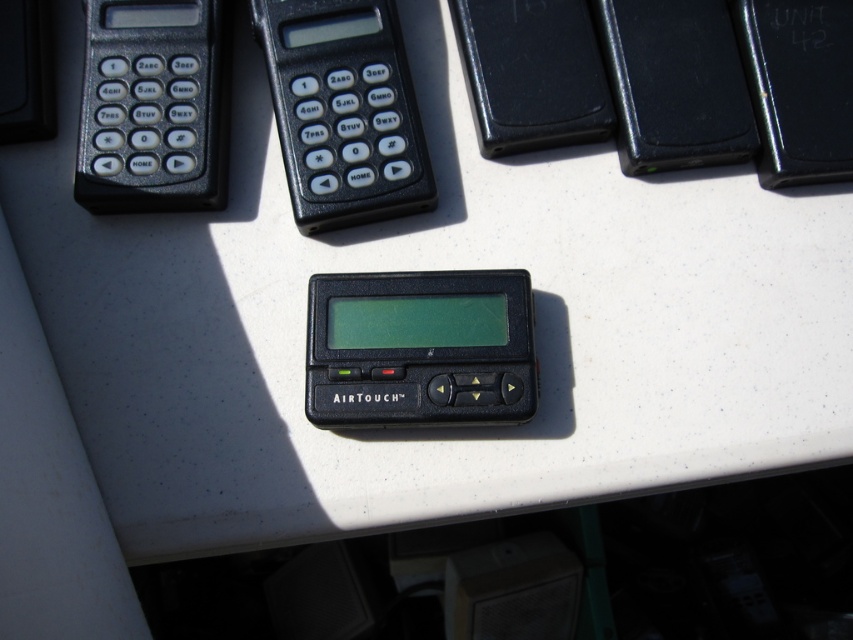
Question: Where is black plastic calculator at upper center located in relation to black plastic calculator at upper left in the image?

Choices:
 (A) right
 (B) left

Answer: (A)

Question: Which of the following is the closest to the observer?

Choices:
 (A) black plastic calculator at upper left
 (B) black plastic calculator at upper center

Answer: (A)

Question: Which of the following is the closest to the observer?

Choices:
 (A) (325, 196)
 (B) (154, 64)

Answer: (A)

Question: Is black plastic calculator at upper center to the left of black plastic calculator at upper left from the viewer's perspective?

Choices:
 (A) yes
 (B) no

Answer: (B)

Question: Can you confirm if black plastic calculator at upper center is smaller than black plastic calculator at upper left?

Choices:
 (A) no
 (B) yes

Answer: (A)